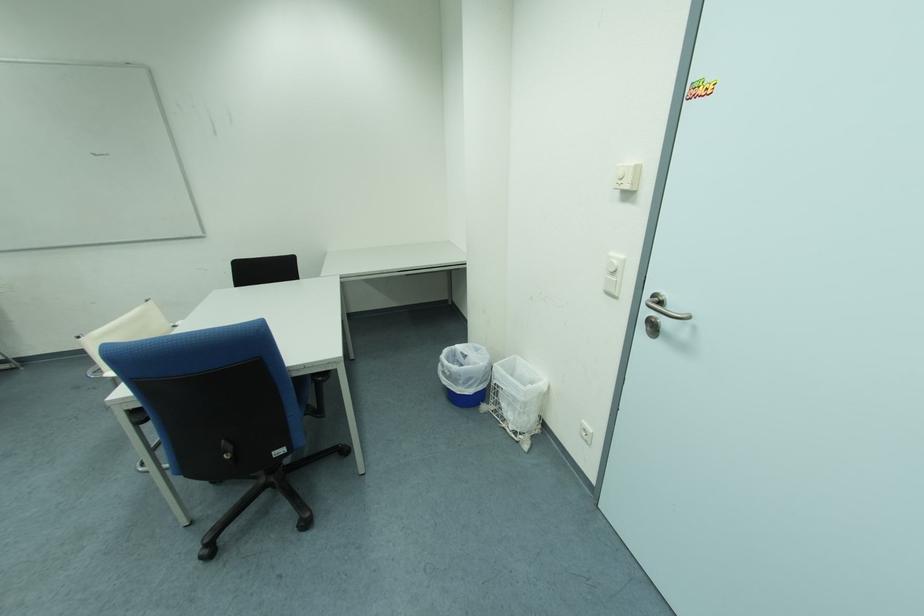
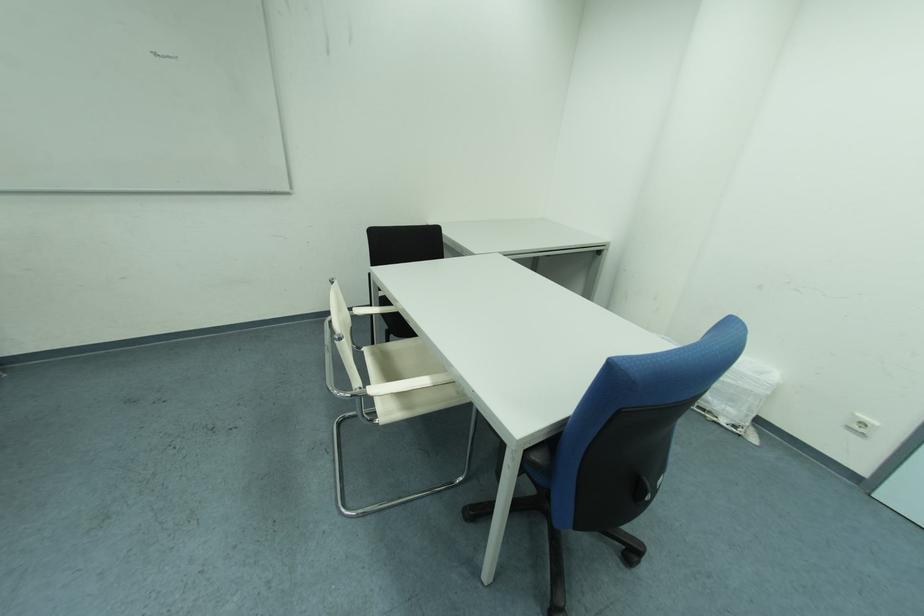
Question: What movement of the cameraman would produce the second image?

Choices:
 (A) Left
 (B) Right
 (C) Forward
 (D) Backward

Answer: (A)